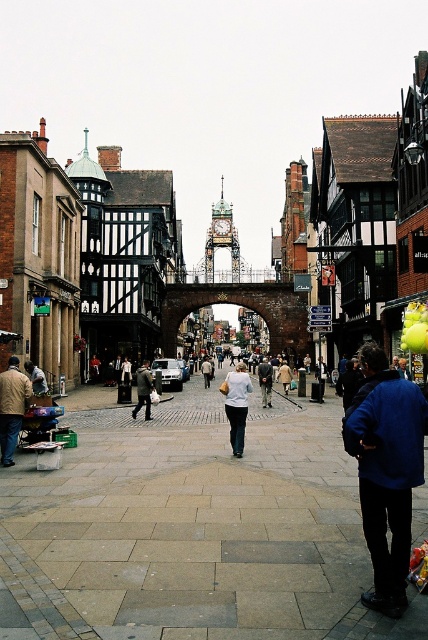
Question: Is blue fabric jacket at lower right further to the viewer compared to light beige sweater at center?

Choices:
 (A) yes
 (B) no

Answer: (B)

Question: Among these objects, which one is farthest from the camera?

Choices:
 (A) dark gray coat at center
 (B) light beige sweater at center
 (C) white matte jacket at center
 (D) blue fabric jacket at lower right

Answer: (B)

Question: Can you confirm if dark gray coat at center is thinner than light brown leather jacket at lower left?

Choices:
 (A) yes
 (B) no

Answer: (B)

Question: Does blue fabric jacket at lower right have a smaller size compared to light brown leather jacket at lower left?

Choices:
 (A) no
 (B) yes

Answer: (A)

Question: Considering the real-world distances, which object is closest to the white matte jacket at center?

Choices:
 (A) light brown leather jacket at lower left
 (B) white cotton shirt at center
 (C) denim jacket at lower left

Answer: (A)

Question: Which object appears closest to the camera in this image?

Choices:
 (A) light beige sweater at center
 (B) blue fabric jacket at lower right

Answer: (B)